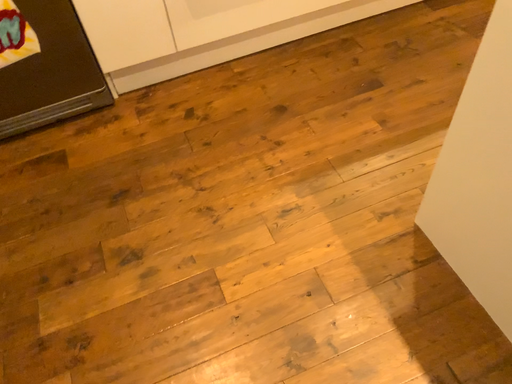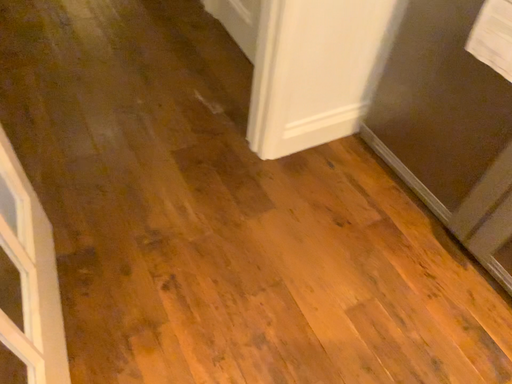
Question: How did the camera likely rotate when shooting the video?

Choices:
 (A) rotated left
 (B) rotated right

Answer: (A)